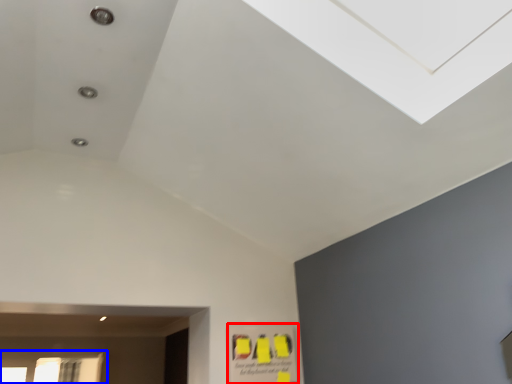
Question: Which point is further to the camera, poster (highlighted by a red box) or window (highlighted by a blue box)?

Choices:
 (A) poster
 (B) window

Answer: (B)